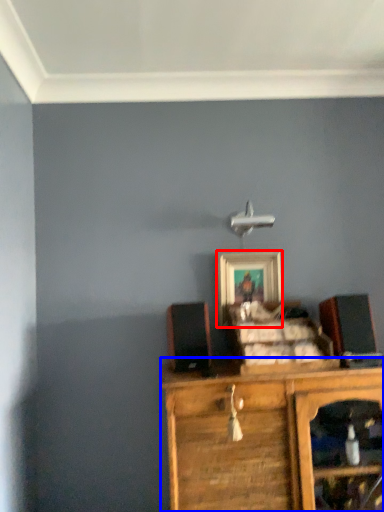
Question: Which point is further to the camera, picture frame (highlighted by a red box) or chest of drawers (highlighted by a blue box)?

Choices:
 (A) picture frame
 (B) chest of drawers

Answer: (A)